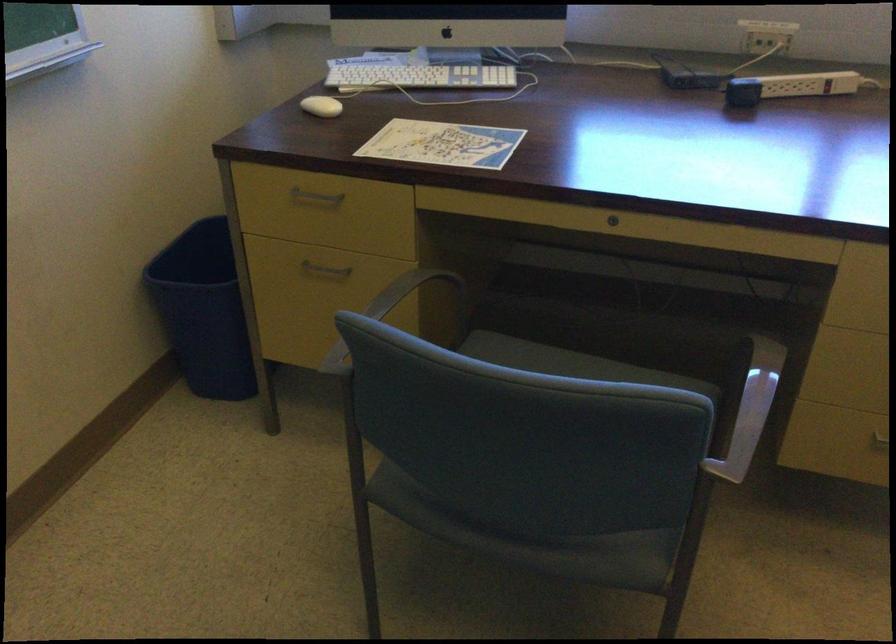
Locate an element on the screen. The height and width of the screenshot is (644, 896). desk drawer lock is located at coordinates 613,220.